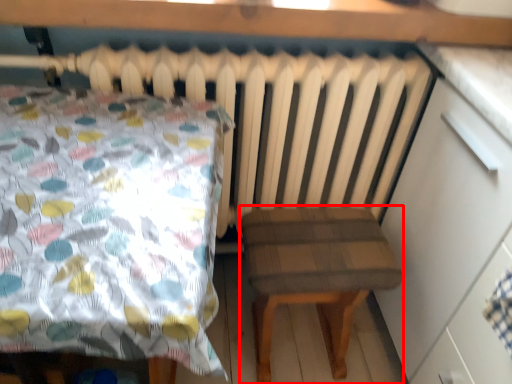
Question: From the image's perspective, what is the correct spatial relationship of stool (annotated by the red box) in relation to dresser?

Choices:
 (A) above
 (B) below

Answer: (B)